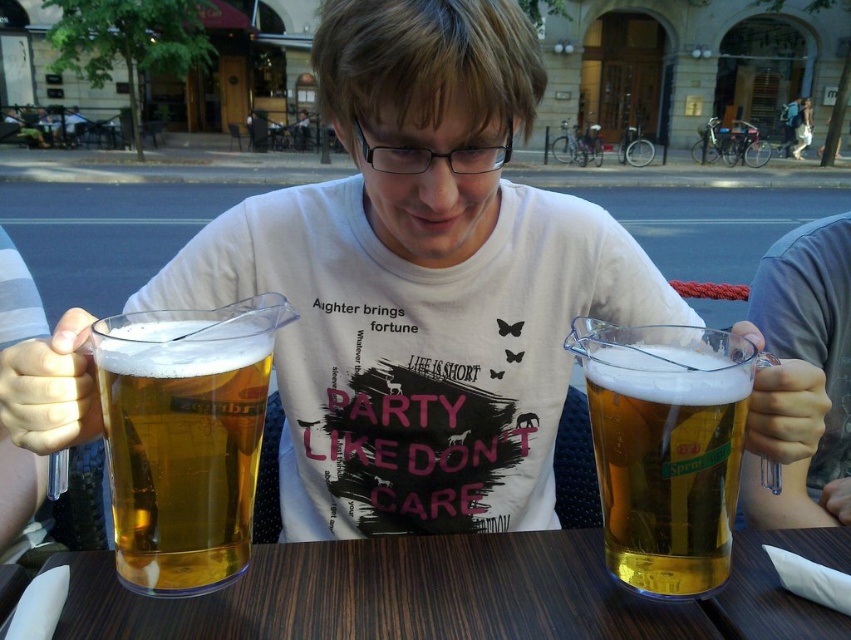
Question: Which object appears closest to the camera in this image?

Choices:
 (A) translucent plastic mug at center
 (B) golden glass mug at left
 (C) wooden table at center

Answer: (B)

Question: Which of the following is the farthest from the observer?

Choices:
 (A) (618, 465)
 (B) (129, 456)

Answer: (A)

Question: Based on their relative distances, which object is farther from the wooden table at center?

Choices:
 (A) translucent plastic mug at center
 (B) golden glass mug at left

Answer: (B)

Question: Is wooden table at center below translucent plastic mug at center?

Choices:
 (A) no
 (B) yes

Answer: (B)

Question: Is wooden table at center in front of translucent plastic mug at center?

Choices:
 (A) no
 (B) yes

Answer: (A)

Question: Is wooden table at center thinner than translucent plastic mug at center?

Choices:
 (A) no
 (B) yes

Answer: (A)